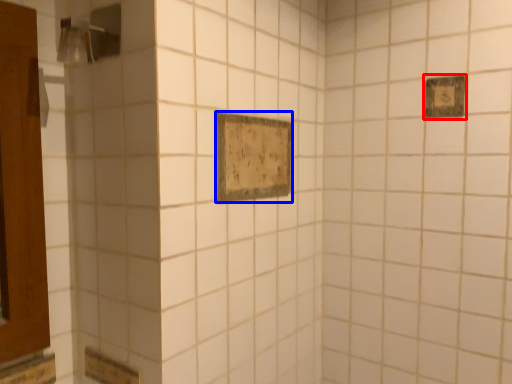
Question: Which of the following is the closest to the observer, rectangle (highlighted by a red box) or rectangle (highlighted by a blue box)?

Choices:
 (A) rectangle
 (B) rectangle

Answer: (B)